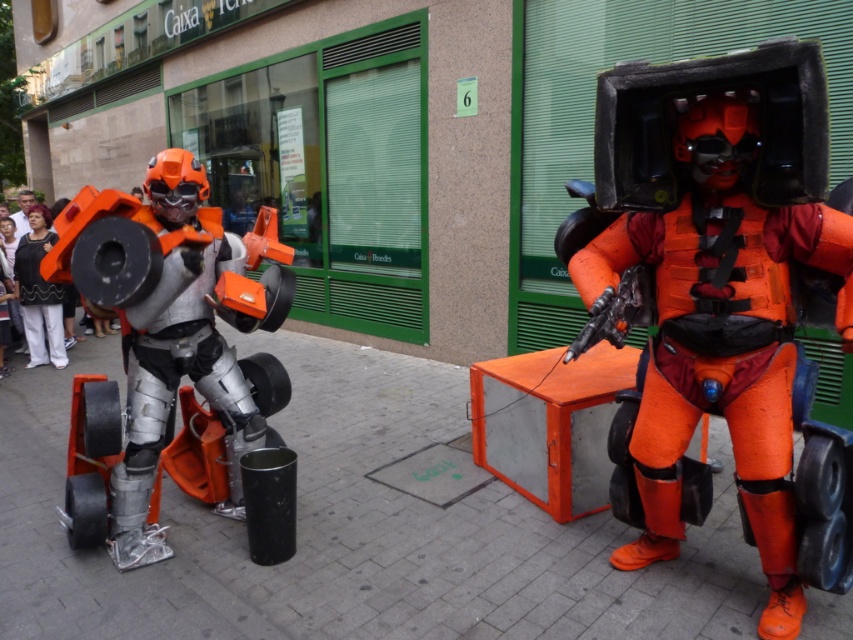
You are a photographer trying to capture the matte orange robot at center and the matte black pants at center in a single shot. Based on their sizes, which object should you focus on first to ensure both are in frame?

The matte orange robot at center is taller than the matte black pants at center, so focusing on the matte orange robot at center first will help ensure both are in frame.

You are a photographer standing at the center of the scene. You want to take a photo of the orange matte robot at right and the matte black pants at center. Considering the distance between them, will you need to adjust your camera focus to capture both clearly in the same shot?

The orange matte robot at right is 20.77 feet away from the matte black pants at center. Since the distance between them is significant, you may need to adjust your camera focus to ensure both are in clear focus, possibly using a smaller aperture for a deeper depth of field.